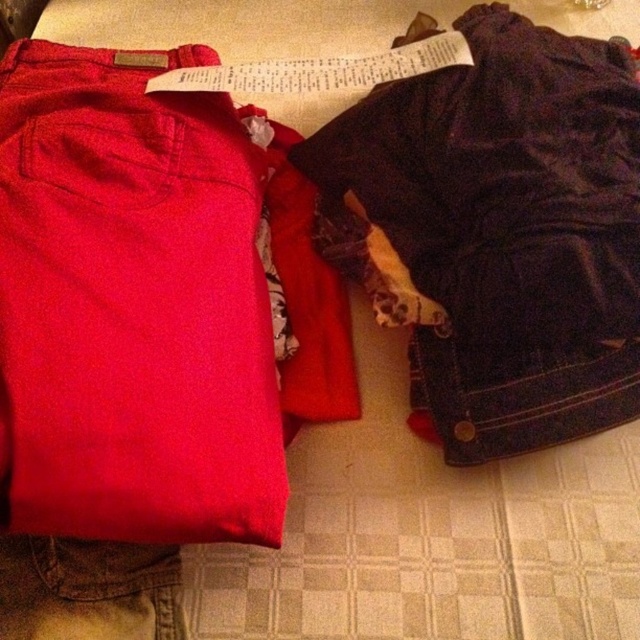
Question: Considering the relative positions of matte cotton pants at left and dark blue corduroy shorts at right in the image provided, where is matte cotton pants at left located with respect to dark blue corduroy shorts at right?

Choices:
 (A) right
 (B) left

Answer: (B)

Question: From the image, what is the correct spatial relationship of matte cotton pants at left in relation to dark blue corduroy shorts at right?

Choices:
 (A) left
 (B) right

Answer: (A)

Question: Does matte cotton pants at left appear over dark blue corduroy shorts at right?

Choices:
 (A) no
 (B) yes

Answer: (A)